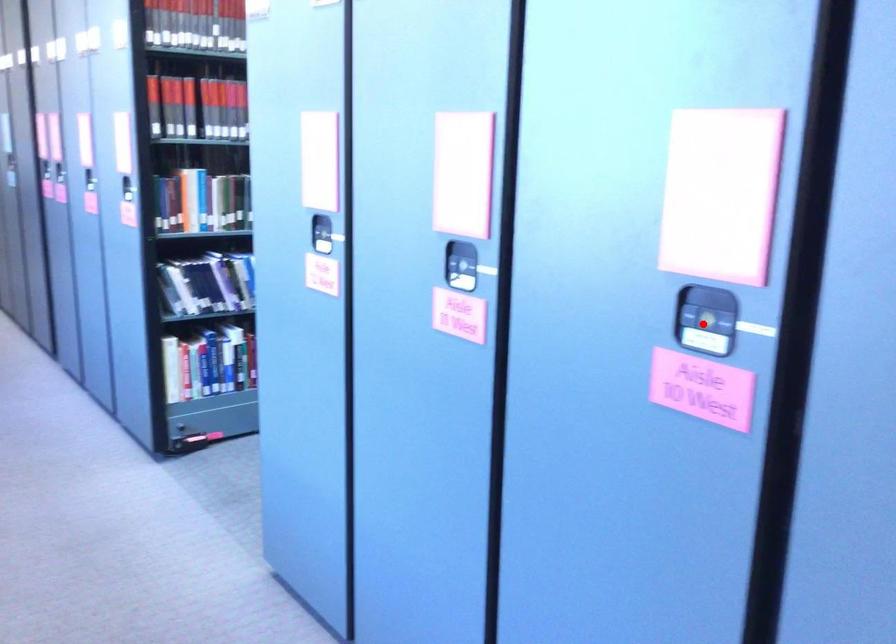
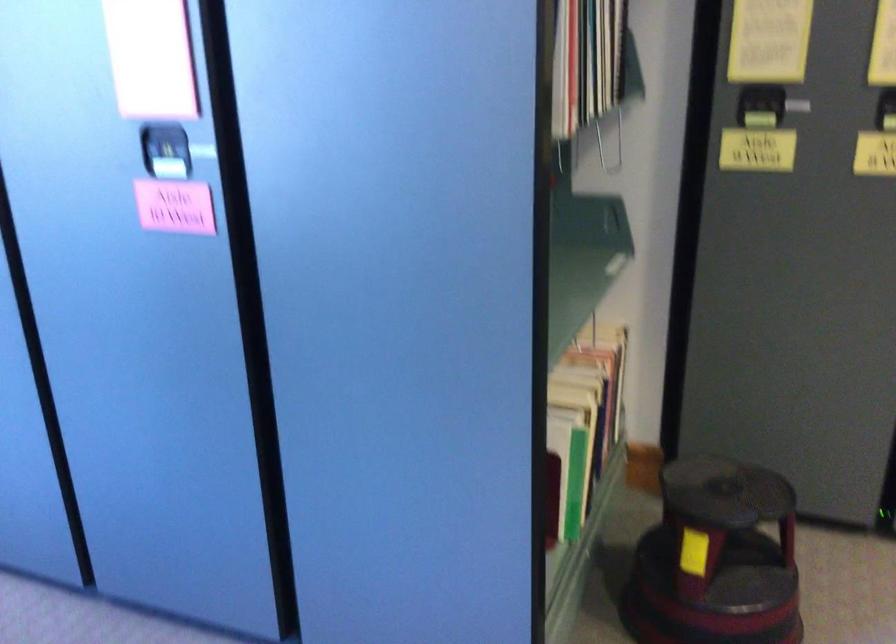
Question: I am providing you with two images of the same scene from different viewpoints. A red point is marked on the first image. Can you still see the location of the red point in image 2?

Choices:
 (A) Yes
 (B) No

Answer: (A)